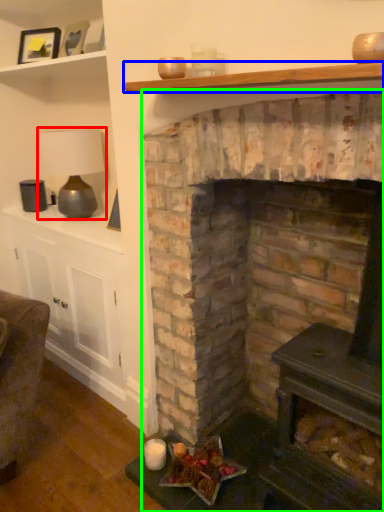
Question: Which is nearer to the lamp (highlighted by a red box)? shelf (highlighted by a blue box) or fireplace (highlighted by a green box).

Choices:
 (A) shelf
 (B) fireplace

Answer: (B)